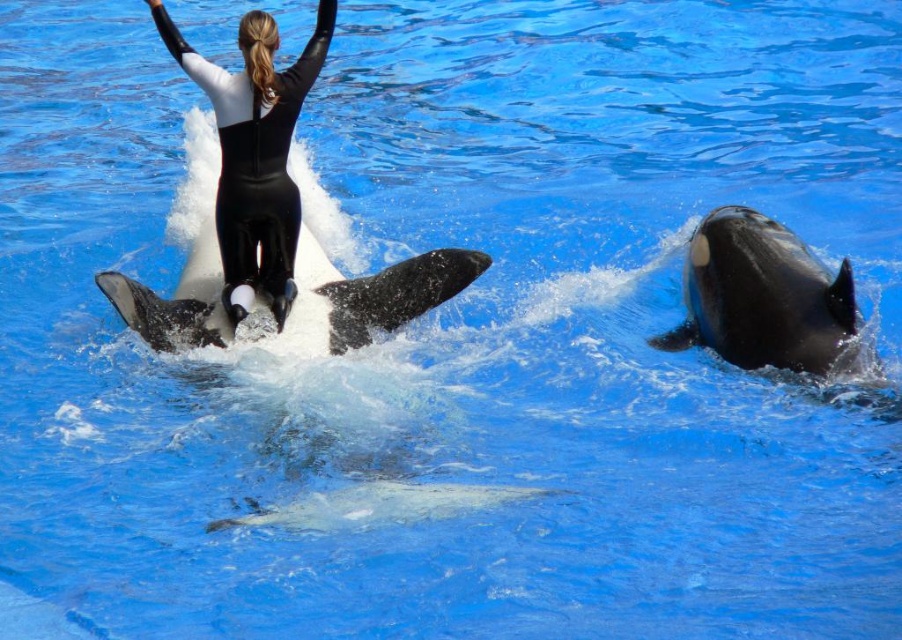
Question: Among these points, which one is nearest to the camera?

Choices:
 (A) (273, 106)
 (B) (778, 362)
 (C) (304, 237)

Answer: (B)

Question: Which point is closer to the camera?

Choices:
 (A) (244, 52)
 (B) (338, 294)

Answer: (A)

Question: Which point is farther to the camera?

Choices:
 (A) black smooth whale at right
 (B) black matte wetsuit at center

Answer: (B)

Question: Is black smooth whale at right to the right of black matte wetsuit at center from the viewer's perspective?

Choices:
 (A) no
 (B) yes

Answer: (B)

Question: From the image, what is the correct spatial relationship of black matte wetsuit at center in relation to black smooth dolphin at center?

Choices:
 (A) left
 (B) right

Answer: (A)

Question: Is black matte wetsuit at center bigger than black smooth dolphin at center?

Choices:
 (A) yes
 (B) no

Answer: (B)